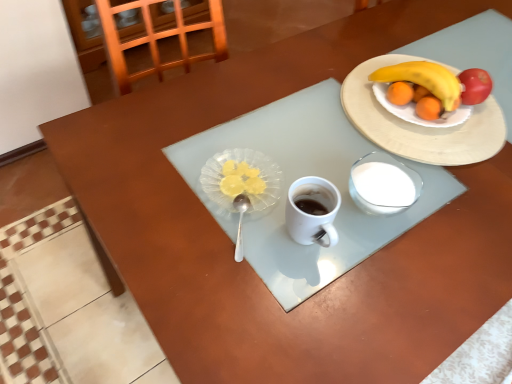
Question: Based on their positions, is white ceramic plate at upper right located to the left or right of translucent glass plate at center?

Choices:
 (A) left
 (B) right

Answer: (B)

Question: Is point (394, 135) closer or farther from the camera than point (264, 200)?

Choices:
 (A) farther
 (B) closer

Answer: (A)

Question: Considering the real-world distances, which object is farthest from the white ceramic plate at upper right?

Choices:
 (A) translucent glass plate at center
 (B) yellow matte banana at upper right
 (C) silver metallic spoon at center

Answer: (C)

Question: Which object is positioned closest to the translucent glass plate at center?

Choices:
 (A) yellow matte banana at upper right
 (B) silver metallic spoon at center
 (C) white ceramic plate at upper right

Answer: (B)